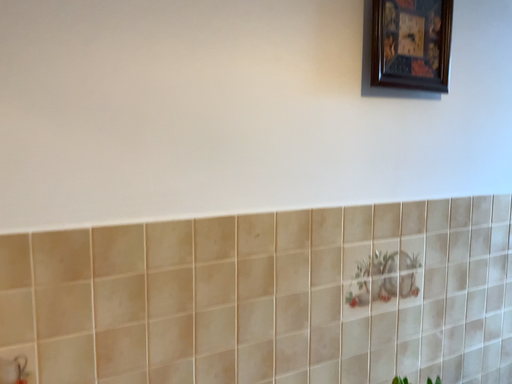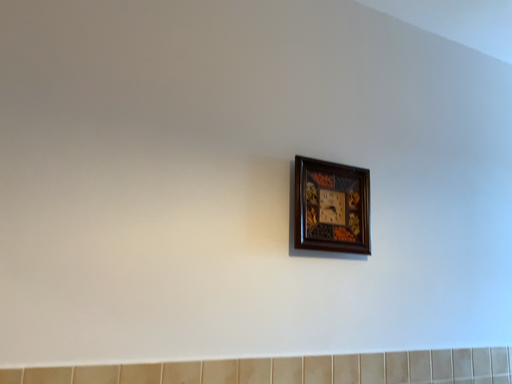
Question: How did the camera likely rotate when shooting the video?

Choices:
 (A) rotated downward
 (B) rotated upward

Answer: (B)